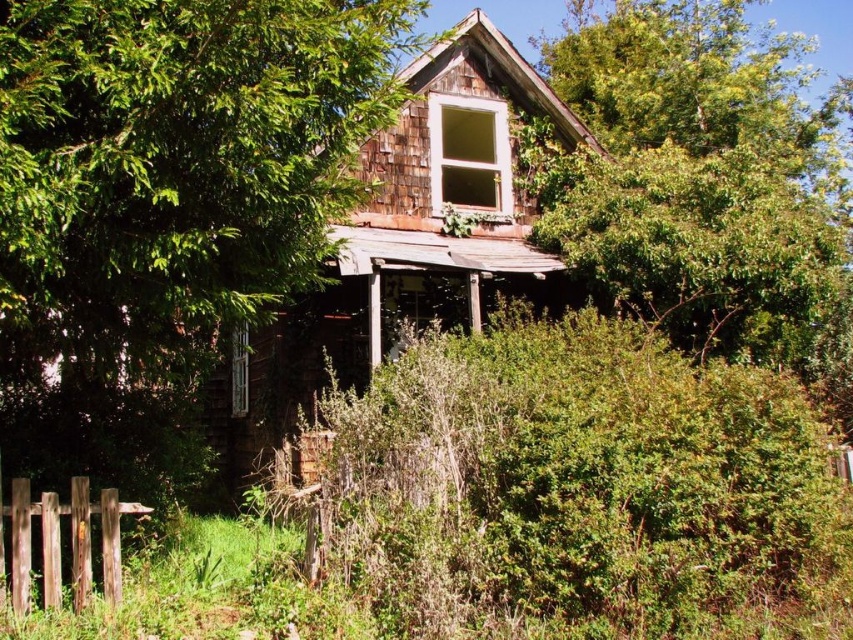
Looking at this image, you are standing in front of the old house and notice two points marked on the structure. The first point is located at coordinate point (454, 556) and the second at point (28, 512). If you were to walk towards the house, which point would you encounter first?

The point at coordinate point (454, 556) is closer to you than point (28, 512), so you would encounter it first as you walk towards the house.

You are standing in front of the old house and notice a green leafy bush at center. Based on its position, can you determine if it is closer to the front of the house or the back?

The green leafy bush at center is located at point coordinates that place it closer to the front of the house, as the coordinates suggest it is positioned near the central area which is typically the front section of the structure.